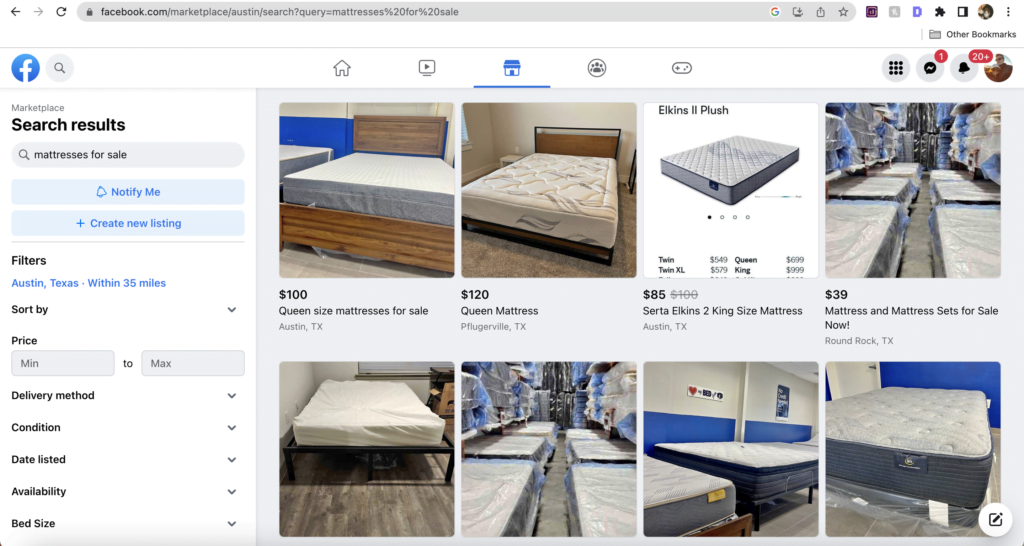
Locate an element on the screen. Image resolution: width=1024 pixels, height=546 pixels. headboards is located at coordinates (399, 130), (581, 145).